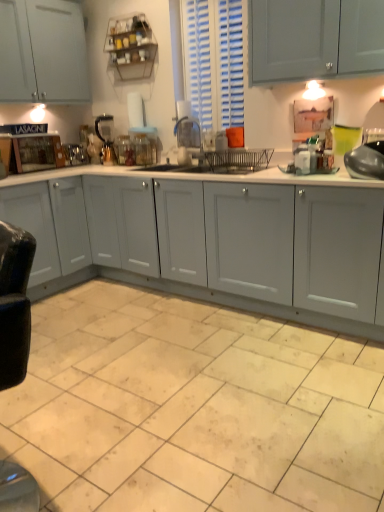
At what (x,y) coordinates should I click in order to perform the action: click on metallic silver coffee maker at center, which is the 5th appliance in right-to-left order. Please return your answer as a coordinate pair (x, y). Looking at the image, I should click on (74, 154).

How much space does metallic silver faucet at center, which appears as the 4th appliance when viewed from the left, occupy horizontally?

8.98 inches.

The image size is (384, 512). What do you see at coordinates (144, 144) in the screenshot?
I see `clear glass jar at center, placed as the third appliance when sorted from back to front` at bounding box center [144, 144].

You are a GUI agent. You are given a task and a screenshot of the screen. Output one action in this format:
    pyautogui.click(x=<x>, y=<y>)
    Task: Click on the metallic silver kettle at center, acting as the second appliance starting from the back
    The width and height of the screenshot is (384, 512).
    Given the screenshot: What is the action you would take?
    pyautogui.click(x=106, y=139)

What do you see at coordinates (192, 408) in the screenshot? I see `beige ceramic tile at lower center` at bounding box center [192, 408].

The width and height of the screenshot is (384, 512). What are the coordinates of `shiny metallic pot at right, the fifth appliance in the back-to-front sequence` in the screenshot? It's located at (366, 161).

From a real-world perspective, between shiny metallic pot at right, marked as the 1th appliance in a front-to-back arrangement, and metallic silver faucet at center, which ranks as the second appliance in front-to-back order, who is vertically lower?

shiny metallic pot at right, marked as the 1th appliance in a front-to-back arrangement.

Which object is positioned more to the right, shiny metallic pot at right, the fifth appliance positioned from the left, or metallic silver faucet at center, which appears as the 4th appliance when viewed from the left?

Positioned to the right is shiny metallic pot at right, the fifth appliance positioned from the left.

How distant is shiny metallic pot at right, marked as the 1th appliance in a front-to-back arrangement, from metallic silver faucet at center, which ranks as the second appliance in front-to-back order?

1.48 meters.

From the image's perspective, is metallic silver coffee maker at center, which is the 5th appliance in right-to-left order, over clear glass jar at center, the third appliance viewed from the right?

Correct, metallic silver coffee maker at center, which is the 5th appliance in right-to-left order, appears higher than clear glass jar at center, the third appliance viewed from the right, in the image.

Is metallic silver coffee maker at center, acting as the first appliance starting from the back, facing away from clear glass jar at center, placed as the third appliance when sorted from back to front?

No.

From a real-world perspective, is metallic silver coffee maker at center, which is the 5th appliance in right-to-left order, positioned under clear glass jar at center, which appears as the third appliance when viewed from the left, based on gravity?

Yes.

Looking at their sizes, would you say metallic silver coffee maker at center, which is the 5th appliance in right-to-left order, is wider or thinner than clear glass jar at center, the third appliance when ordered from front to back?

metallic silver coffee maker at center, which is the 5th appliance in right-to-left order, is thinner than clear glass jar at center, the third appliance when ordered from front to back.

Which appliance is the 1st one when counting from the left side of the clear glass jar at center, the third appliance viewed from the right? Please provide its 2D coordinates.

[(106, 139)]

Who is taller, metallic silver kettle at center, the second appliance positioned from the left, or clear glass jar at center, the third appliance when ordered from front to back?

Standing taller between the two is metallic silver kettle at center, the second appliance positioned from the left.

Who is bigger, metallic silver kettle at center, acting as the second appliance starting from the back, or clear glass jar at center, the third appliance viewed from the right?

Bigger between the two is metallic silver kettle at center, acting as the second appliance starting from the back.

Is wooden cutting board at left positioned with its back to metallic silver coffee maker at center, acting as the first appliance starting from the back?

No.

How much distance is there between wooden cutting board at left and metallic silver coffee maker at center, acting as the first appliance starting from the back?

wooden cutting board at left is 12.17 inches from metallic silver coffee maker at center, acting as the first appliance starting from the back.

The width and height of the screenshot is (384, 512). In order to click on appliance that is the 1st object to the right of the wooden cutting board at left, starting at the anchor in this screenshot , I will do `click(74, 154)`.

Is wooden cutting board at left positioned in front of metallic silver coffee maker at center, marked as the 5th appliance in a front-to-back arrangement?

That is True.

Is wooden cutting board at left positioned with its back to clear glass jar at center, the third appliance when ordered from front to back?

That's not correct — wooden cutting board at left is not looking away from clear glass jar at center, the third appliance when ordered from front to back.

Is wooden cutting board at left to the left of clear glass jar at center, which appears as the third appliance when viewed from the left, from the viewer's perspective?

Yes.

Is wooden cutting board at left bigger or smaller than clear glass jar at center, which appears as the third appliance when viewed from the left?

In the image, wooden cutting board at left appears to be larger than clear glass jar at center, which appears as the third appliance when viewed from the left.

From the image's perspective, who appears lower, wooden cutting board at left or clear glass jar at center, the third appliance viewed from the right?

wooden cutting board at left.

Can you confirm if metallic silver coffee maker at center, acting as the first appliance starting from the back, is bigger than metallic silver kettle at center, acting as the second appliance starting from the back?

Incorrect, metallic silver coffee maker at center, acting as the first appliance starting from the back, is not larger than metallic silver kettle at center, acting as the second appliance starting from the back.

From a real-world perspective, is metallic silver coffee maker at center, which is the 5th appliance in right-to-left order, located beneath metallic silver kettle at center, the 4th appliance when ordered from front to back?

Correct, in the physical world, metallic silver coffee maker at center, which is the 5th appliance in right-to-left order, is lower than metallic silver kettle at center, the 4th appliance when ordered from front to back.

From the image's perspective, does metallic silver coffee maker at center, marked as the 5th appliance in a front-to-back arrangement, appear lower than metallic silver kettle at center, acting as the second appliance starting from the back?

Yes.

Is metallic silver coffee maker at center, acting as the first appliance starting from the back, positioned behind metallic silver kettle at center, the second appliance positioned from the left?

Yes, metallic silver coffee maker at center, acting as the first appliance starting from the back, is further from the viewer.

Can you confirm if beige ceramic tile at lower center is smaller than teal glass at upper right?

No.

Looking at this image, considering the relative positions of beige ceramic tile at lower center and teal glass at upper right in the image provided, is beige ceramic tile at lower center behind teal glass at upper right?

No, the depth of beige ceramic tile at lower center is less than that of teal glass at upper right.

From a real-world perspective, is beige ceramic tile at lower center physically located above or below teal glass at upper right?

beige ceramic tile at lower center is situated lower than teal glass at upper right in the real world.

Is teal glass at upper right at the back of beige ceramic tile at lower center?

No, teal glass at upper right is not at the back of beige ceramic tile at lower center.

Which appliance is the 1st one when counting from the back of the shiny metallic pot at right, the fifth appliance positioned from the left? Please provide its 2D coordinates.

[(188, 139)]

From a real-world perspective, count 2nd appliances downward from the clear glass jar at center, which appears as the third appliance when viewed from the left, and point to it. Please provide its 2D coordinates.

[(74, 154)]

When comparing their distances from teal glass at upper right, does clear glass jar at center, the third appliance viewed from the right, or wooden cutting board at left seem further?

The object further to teal glass at upper right is wooden cutting board at left.

Which object lies nearer to the anchor point teal glass at upper right, wooden cutting board at left or shiny metallic pot at right, the fifth appliance positioned from the left?

Based on the image, shiny metallic pot at right, the fifth appliance positioned from the left, appears to be nearer to teal glass at upper right.

From the picture: When comparing their distances from metallic silver faucet at center, the fourth appliance in the back-to-front sequence, does teal glass at upper right or beige ceramic tile at lower center seem closer?

teal glass at upper right is closer to metallic silver faucet at center, the fourth appliance in the back-to-front sequence.

When comparing their distances from metallic silver faucet at center, which ranks as the second appliance in front-to-back order, does wooden cutting board at left or shiny metallic pot at right, marked as the 1th appliance in a front-to-back arrangement, seem further?

shiny metallic pot at right, marked as the 1th appliance in a front-to-back arrangement, is further to metallic silver faucet at center, which ranks as the second appliance in front-to-back order.

From the image, which object appears to be farther from shiny metallic pot at right, marked as the 1th appliance in a front-to-back arrangement, teal glass at upper right or metallic silver faucet at center, the fourth appliance in the back-to-front sequence?

The object further to shiny metallic pot at right, marked as the 1th appliance in a front-to-back arrangement, is metallic silver faucet at center, the fourth appliance in the back-to-front sequence.

When comparing their distances from metallic silver faucet at center, which appears as the 4th appliance when viewed from the left, does wooden cutting board at left or metallic silver coffee maker at center, which is the 5th appliance in right-to-left order, seem further?

wooden cutting board at left lies further to metallic silver faucet at center, which appears as the 4th appliance when viewed from the left, than the other object.

Based on their spatial positions, is metallic silver coffee maker at center, marked as the 5th appliance in a front-to-back arrangement, or metallic silver kettle at center, the second appliance positioned from the left, closer to metallic silver faucet at center, the 2th appliance when ordered from right to left?

metallic silver kettle at center, the second appliance positioned from the left, lies closer to metallic silver faucet at center, the 2th appliance when ordered from right to left, than the other object.

Estimate the real-world distances between objects in this image. Which object is further from clear glass jar at center, the third appliance viewed from the right, metallic silver coffee maker at center, marked as the 1th appliance in a left-to-right arrangement, or metallic silver faucet at center, the 2th appliance when ordered from right to left?

metallic silver coffee maker at center, marked as the 1th appliance in a left-to-right arrangement, is further to clear glass jar at center, the third appliance viewed from the right.

Locate an element on the screen. This screenshot has width=384, height=512. appliance between metallic silver kettle at center, acting as the second appliance starting from the back, and metallic silver faucet at center, the 2th appliance when ordered from right to left is located at coordinates (144, 144).

You are a GUI agent. You are given a task and a screenshot of the screen. Output one action in this format:
    pyautogui.click(x=<x>, y=<y>)
    Task: Click on the home appliance located between beige ceramic tile at lower center and metallic silver coffee maker at center, which is the 5th appliance in right-to-left order, in the depth direction
    This screenshot has height=512, width=384.
    Given the screenshot: What is the action you would take?
    pyautogui.click(x=32, y=152)

Locate an element on the screen. teal between beige ceramic tile at lower center and clear glass jar at center, the third appliance viewed from the right, from front to back is located at coordinates (344, 139).

Find the location of a particular element. teal between beige ceramic tile at lower center and wooden cutting board at left in the front-back direction is located at coordinates (344, 139).